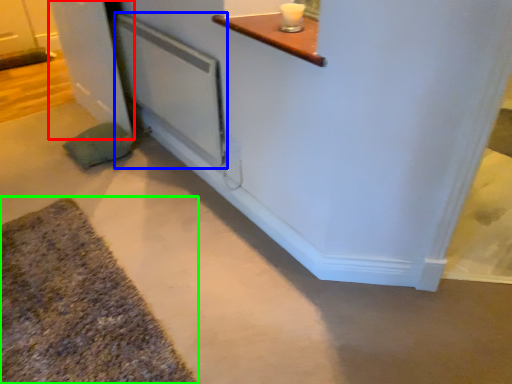
Question: Which is nearer to the door (highlighted by a red box)? screen door (highlighted by a blue box) or bath mat (highlighted by a green box).

Choices:
 (A) screen door
 (B) bath mat

Answer: (A)